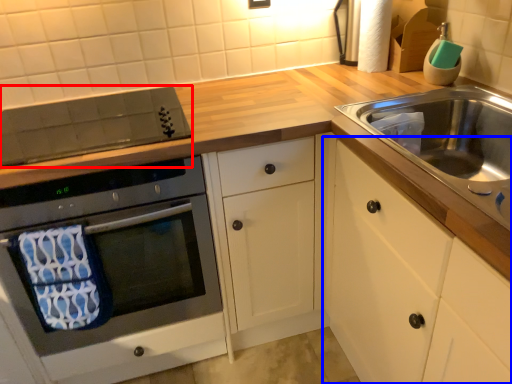
Question: Which object appears closest to the camera in this image, appliance (highlighted by a red box) or cabinetry (highlighted by a blue box)?

Choices:
 (A) appliance
 (B) cabinetry

Answer: (B)